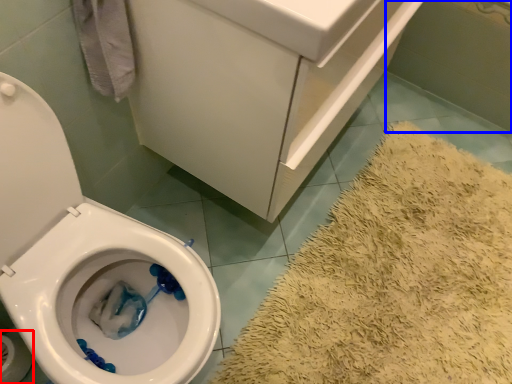
Question: Which of the following is the farthest to the observer, toilet paper (highlighted by a red box) or bath (highlighted by a blue box)?

Choices:
 (A) toilet paper
 (B) bath

Answer: (B)